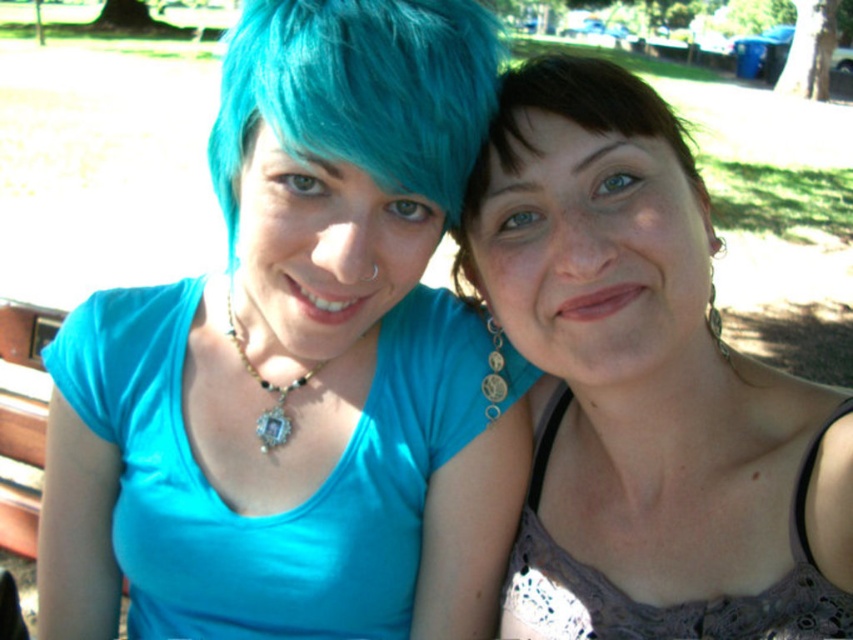
Question: Does matte blue shirt at left have a larger size compared to matte purple tank top at center?

Choices:
 (A) yes
 (B) no

Answer: (A)

Question: Which point is farther from the camera taking this photo?

Choices:
 (A) (247, 257)
 (B) (672, 216)
 (C) (466, 300)

Answer: (C)

Question: Considering the real-world distances, which object is farthest from the brown matte hair at center?

Choices:
 (A) matte blue shirt at left
 (B) matte purple tank top at center
 (C) matte glass pendant at center

Answer: (C)

Question: Is the position of matte purple tank top at center less distant than that of brown matte hair at center?

Choices:
 (A) yes
 (B) no

Answer: (A)

Question: Which point appears closest to the camera in this image?

Choices:
 (A) (282, 413)
 (B) (589, 116)

Answer: (B)

Question: Observing the image, what is the correct spatial positioning of matte purple tank top at center in reference to brown matte hair at center?

Choices:
 (A) above
 (B) below

Answer: (B)